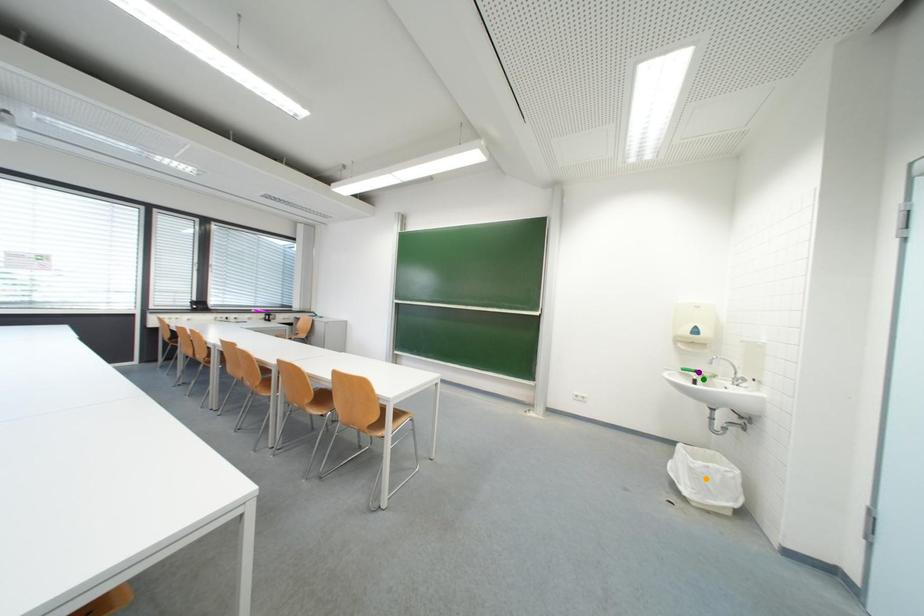
Order these from nearest to farthest:
orange point | green point | purple point

orange point, green point, purple point